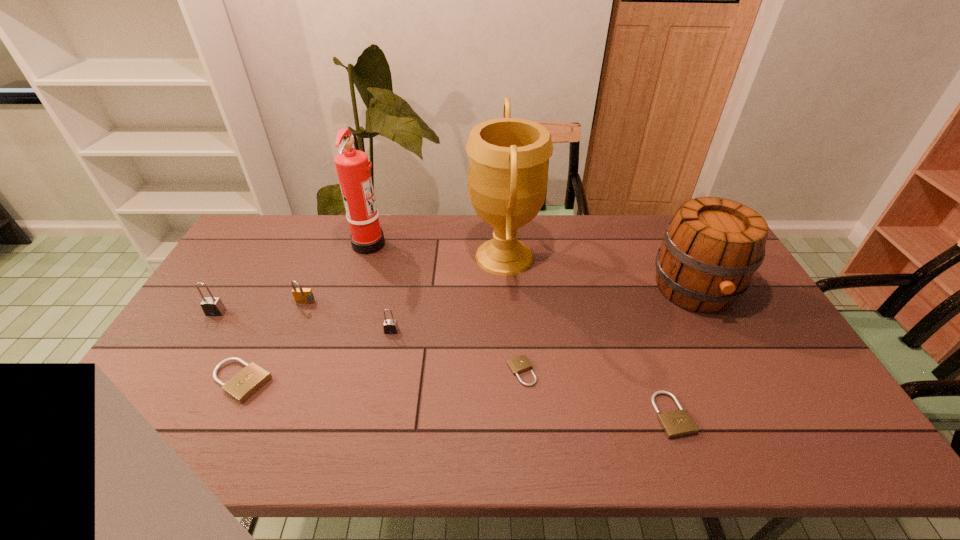
This screenshot has width=960, height=540. What are the coordinates of `vacant region between the rightmost object and the leftmost beige padlock` in the screenshot? It's located at tap(468, 335).

The height and width of the screenshot is (540, 960). In order to click on free space between the shortest padlock and the seventh shortest object in this screenshot , I will do `click(608, 330)`.

Identify the location of free point between the left gray padlock and the farthest padlock. (260, 308).

Point out which object is positioned as the second nearest to the shortest padlock. Please provide its 2D coordinates. Your answer should be formatted as a tuple, i.e. [(x, y)], where the tuple contains the x and y coordinates of a point satisfying the conditions above.

[(677, 423)]

Locate which object is the sixth closest to the eighth tallest object. Please provide its 2D coordinates. Your answer should be formatted as a tuple, i.e. [(x, y)], where the tuple contains the x and y coordinates of a point satisfying the conditions above.

[(250, 379)]

Where is `the fourth closest padlock to the second smallest beige padlock`? the fourth closest padlock to the second smallest beige padlock is located at coordinates (301, 295).

Identify which padlock is located as the fourth nearest to the third shortest object. Please provide its 2D coordinates. Your answer should be formatted as a tuple, i.e. [(x, y)], where the tuple contains the x and y coordinates of a point satisfying the conditions above.

[(519, 364)]

I want to click on the closest beige padlock to the rightmost object, so click(x=677, y=423).

Locate which beige padlock is the third closest to the nearer gray padlock. Please provide its 2D coordinates. Your answer should be formatted as a tuple, i.e. [(x, y)], where the tuple contains the x and y coordinates of a point satisfying the conditions above.

[(677, 423)]

You are a GUI agent. You are given a task and a screenshot of the screen. Output one action in this format:
    pyautogui.click(x=<x>, y=<y>)
    Task: Click on the vacant space that satisfies the following two spatial constraints: 1. at the nozzle of the sixth object from right to left; 2. on the back side of the rightmost padlock
    
    Given the screenshot: What is the action you would take?
    pyautogui.click(x=317, y=415)